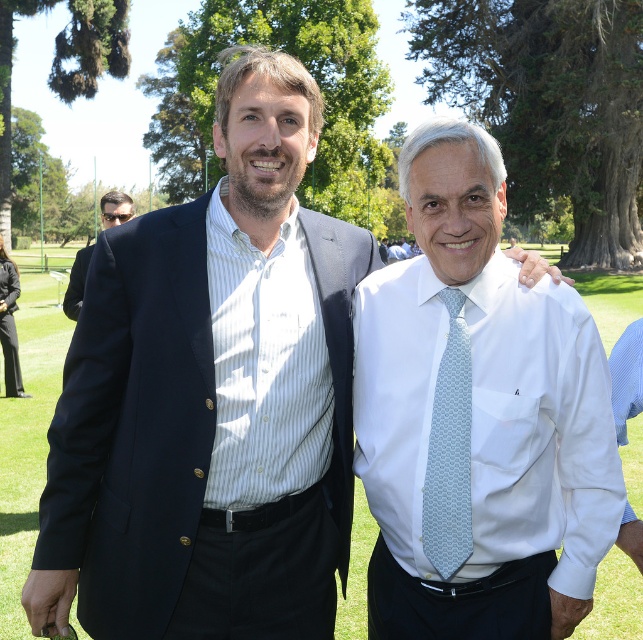
You are a photographer who needs to adjust the lighting to ensure both the light blue woven tie at center and the black fabric business suit at left are clearly visible. Which object might require more light adjustment due to its darker color and position relative to the other?

The black fabric business suit at left might require more light adjustment because it is darker in color and positioned over the light blue woven tie at center, potentially casting shadows on it.

You are a photographer trying to focus on the white silk shirt at center. What are the coordinates where you should aim your camera?

The white silk shirt at center is located at coordinates 0.655 in the x axis and 0.743 in the y axis, so aim your camera at those coordinates.